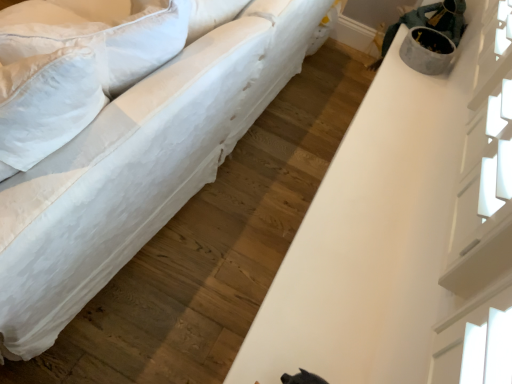
Locate an element on the screen. white fabric couch at left is located at coordinates (137, 168).

Describe the element at coordinates (137, 168) in the screenshot. The image size is (512, 384). I see `white fabric couch at left` at that location.

Image resolution: width=512 pixels, height=384 pixels. I want to click on white fabric couch at left, so click(137, 168).